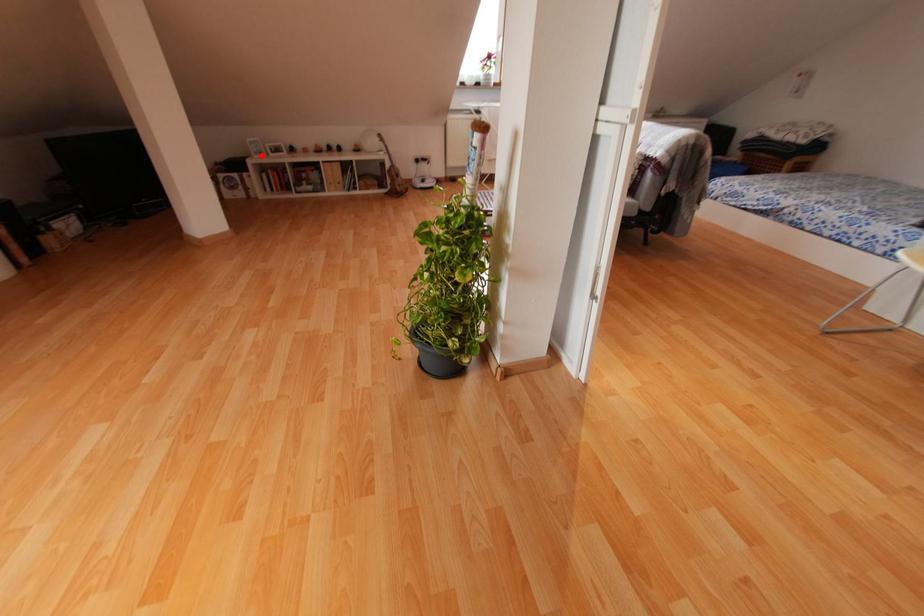
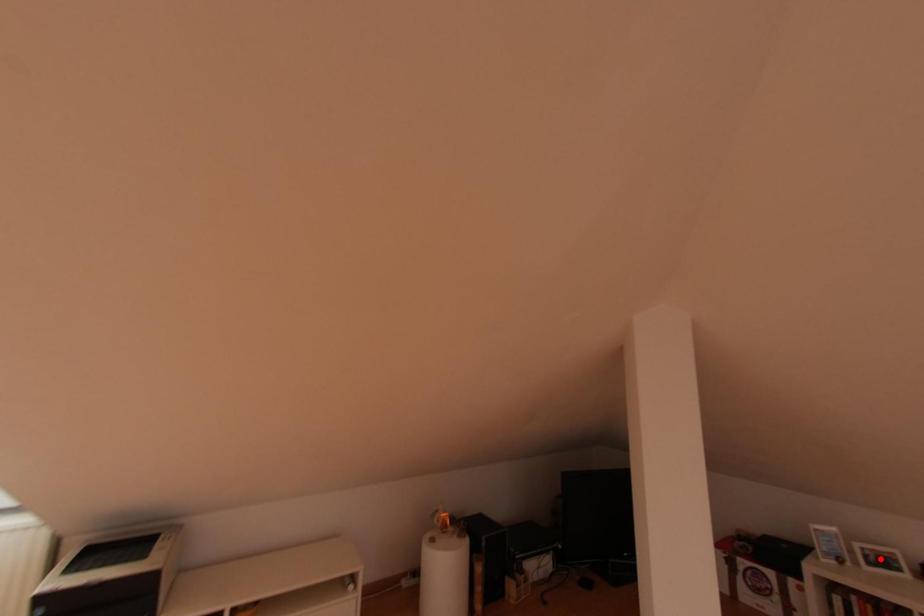
I am providing you with two images of the same scene from different viewpoints. A red point is marked on the first image and another point is marked on the second image. Are the points marked in image1 and image2 representing the same 3D position?

No